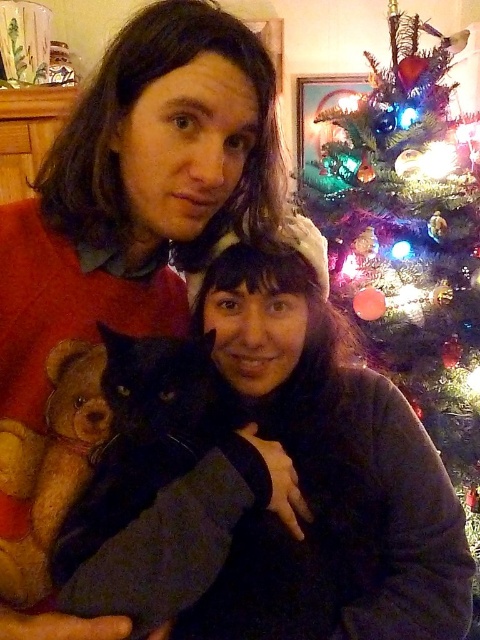
Question: Which point is farther from the camera taking this photo?

Choices:
 (A) (406, 237)
 (B) (186, 394)
 (C) (55, 532)

Answer: (A)

Question: Can you confirm if green matte christmas tree at upper right is positioned above light brown plush teddy bear at left?

Choices:
 (A) no
 (B) yes

Answer: (B)

Question: Is green matte christmas tree at upper right to the left of light brown plush teddy bear at left from the viewer's perspective?

Choices:
 (A) yes
 (B) no

Answer: (B)

Question: Among these objects, which one is nearest to the camera?

Choices:
 (A) light brown plush teddy bear at left
 (B) black fur cat at center

Answer: (B)

Question: Does black fur cat at center appear on the left side of light brown plush teddy bear at left?

Choices:
 (A) yes
 (B) no

Answer: (B)

Question: Which object is the closest to the light brown plush teddy bear at left?

Choices:
 (A) green matte christmas tree at upper right
 (B) black fur cat at center

Answer: (B)